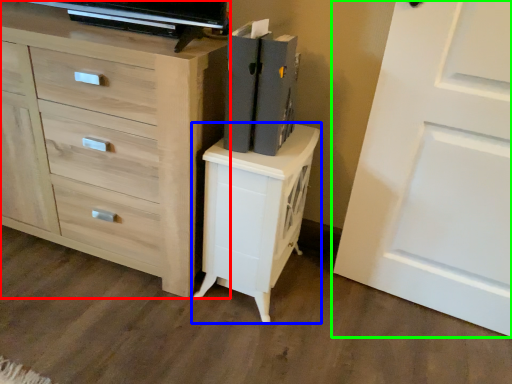
Question: Which object is positioned closest to chest of drawers (highlighted by a red box)? Select from nightstand (highlighted by a blue box) and door (highlighted by a green box).

Choices:
 (A) nightstand
 (B) door

Answer: (A)